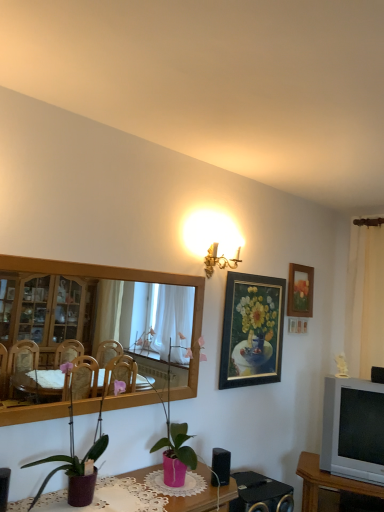
Question: Is gold-framed painting at upper right, which appears as the second picture frame when viewed from the back, at the back of purple matte plant pot at lower left, acting as the second houseplant starting from the right?

Choices:
 (A) no
 (B) yes

Answer: (A)

Question: From the image's perspective, is purple matte plant pot at lower left, which is the 1th houseplant from front to back, on top of gold-framed painting at upper right, which is counted as the first picture frame, starting from the left?

Choices:
 (A) no
 (B) yes

Answer: (A)

Question: Is purple matte plant pot at lower left, which is the first houseplant in left-to-right order, shorter than gold-framed painting at upper right, which is counted as the first picture frame, starting from the left?

Choices:
 (A) yes
 (B) no

Answer: (A)

Question: Is purple matte plant pot at lower left, which is the 1th houseplant from front to back, with gold-framed painting at upper right, which appears as the second picture frame when viewed from the back?

Choices:
 (A) yes
 (B) no

Answer: (B)

Question: From the image's perspective, does purple matte plant pot at lower left, acting as the second houseplant starting from the right, appear lower than gold-framed painting at upper right, which appears as the second picture frame when viewed from the back?

Choices:
 (A) yes
 (B) no

Answer: (A)

Question: Choose the correct answer: Is white fabric curtain at right inside pink matte plant pot at center, which is counted as the 1th houseplant, starting from the right, or outside it?

Choices:
 (A) outside
 (B) inside

Answer: (A)

Question: Is point (375, 308) closer or farther from the camera than point (163, 445)?

Choices:
 (A) closer
 (B) farther

Answer: (B)

Question: Visually, is white fabric curtain at right positioned to the left or to the right of pink matte plant pot at center, which is counted as the 1th houseplant, starting from the right?

Choices:
 (A) left
 (B) right

Answer: (B)

Question: Considering the positions of white fabric curtain at right and pink matte plant pot at center, which is counted as the 1th houseplant, starting from the right, in the image, is white fabric curtain at right wider or thinner than pink matte plant pot at center, which is counted as the 1th houseplant, starting from the right,?

Choices:
 (A) wide
 (B) thin

Answer: (A)

Question: From a real-world perspective, is wooden picture frame at upper right, marked as the first picture frame in a right-to-left arrangement, positioned above or below purple matte plant pot at lower left, which is the first houseplant in left-to-right order?

Choices:
 (A) below
 (B) above

Answer: (B)

Question: Relative to purple matte plant pot at lower left, acting as the second houseplant starting from the right, is wooden picture frame at upper right, marked as the first picture frame in a right-to-left arrangement, in front or behind?

Choices:
 (A) front
 (B) behind

Answer: (B)

Question: Does point (299, 306) appear closer or farther from the camera than point (66, 473)?

Choices:
 (A) closer
 (B) farther

Answer: (B)

Question: Is wooden picture frame at upper right, which is counted as the first picture frame, starting from the back, inside the boundaries of purple matte plant pot at lower left, which is the first houseplant in left-to-right order, or outside?

Choices:
 (A) inside
 (B) outside

Answer: (B)

Question: From a real-world perspective, relative to silver metallic television at right, is matte pink vase at lower center, the second table positioned from the bottom, vertically above or below?

Choices:
 (A) below
 (B) above

Answer: (A)

Question: Is matte pink vase at lower center, which appears as the second table when viewed from the back, inside the boundaries of silver metallic television at right, or outside?

Choices:
 (A) inside
 (B) outside

Answer: (B)